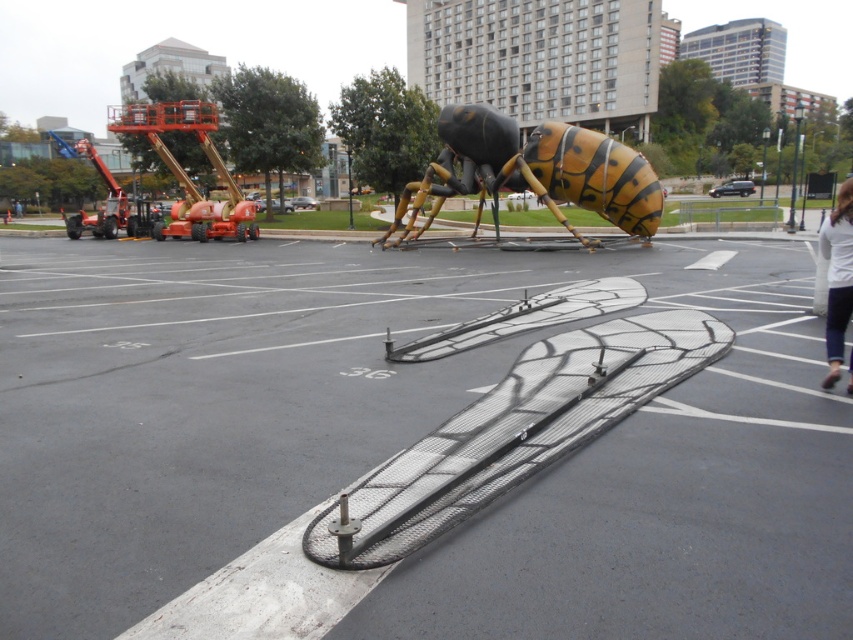
In order to click on metallic gray parking lot at center in this screenshot , I will do `click(407, 440)`.

Who is lower down, metallic gray parking lot at center or yellow/black striped insect at center?

metallic gray parking lot at center is lower down.

Which is behind, point (717, 406) or point (645, 170)?

Point (645, 170)

Where is `metallic gray parking lot at center`? The height and width of the screenshot is (640, 853). metallic gray parking lot at center is located at coordinates (x=407, y=440).